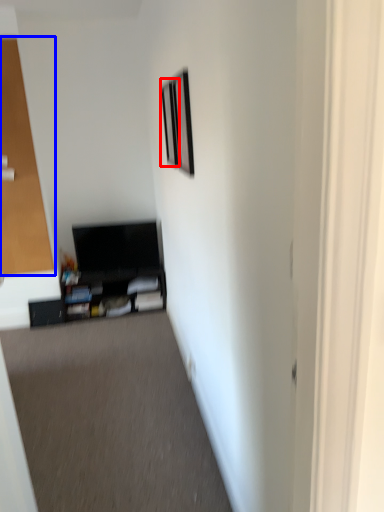
Question: Which point is closer to the camera, picture frame (highlighted by a red box) or glass door (highlighted by a blue box)?

Choices:
 (A) picture frame
 (B) glass door

Answer: (A)